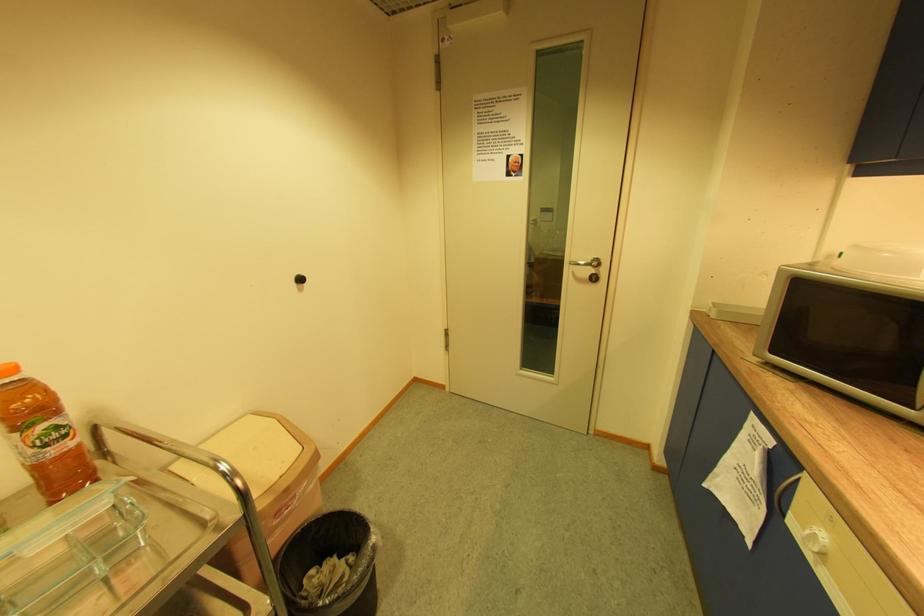
I want to click on beige trash can lid, so click(x=245, y=455).